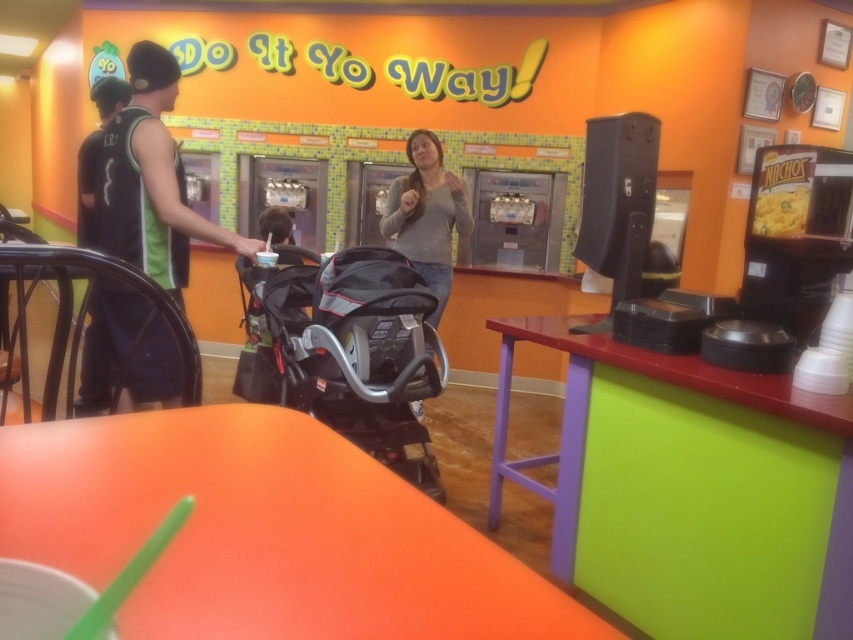
Question: Which point is closer to the camera?

Choices:
 (A) gray matte sweater at center
 (B) black textured stroller at center
 (C) black sleeveless shirt at left
 (D) yellow matte nachos at upper right

Answer: (D)

Question: Can you confirm if black textured stroller at center is wider than yellow matte nachos at upper right?

Choices:
 (A) yes
 (B) no

Answer: (A)

Question: Estimate the real-world distances between objects in this image. Which object is closer to the black sleeveless shirt at left?

Choices:
 (A) gray matte sweater at center
 (B) yellow matte nachos at upper right

Answer: (A)

Question: Does black sleeveless shirt at left appear on the right side of gray matte sweater at center?

Choices:
 (A) yes
 (B) no

Answer: (B)

Question: Can you confirm if gray matte sweater at center is positioned above yellow matte nachos at upper right?

Choices:
 (A) no
 (B) yes

Answer: (B)

Question: Which object is closer to the camera taking this photo?

Choices:
 (A) yellow matte nachos at upper right
 (B) black sleeveless shirt at left
 (C) gray matte sweater at center
 (D) black textured stroller at center

Answer: (A)